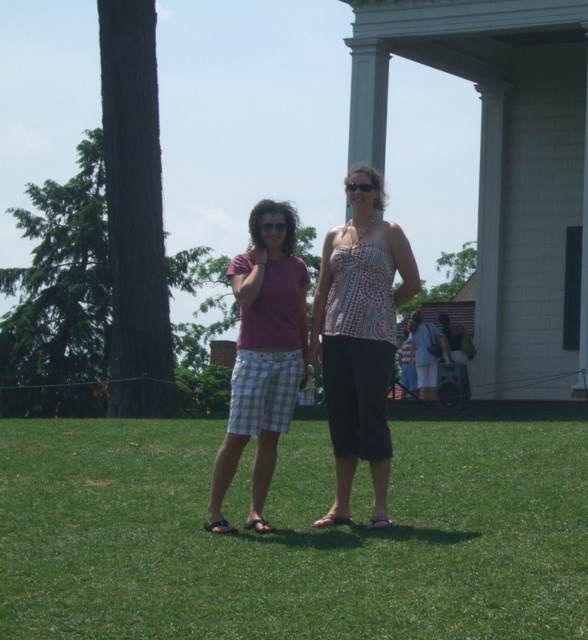
You are planning to set up a picnic blanket in the grassy area. Given that the picnic blanket is the size of the printed fabric top at center, will it fit entirely on the green grass at center?

The green grass at center is bigger than the printed fabric top at center, so the picnic blanket will fit entirely on the green grass at center.

You are planning to lay a picnic blanket on the green grass at center and plaid shorts at center. Which area can accommodate a larger blanket?

The green grass at center has a larger width than the plaid shorts at center, so it can accommodate a larger picnic blanket.

You are planning to place a small garden bench between the green grass at center and the plaid shorts at center. Given that the bench requires 2.5 meters of space, will there be enough room?

The green grass at center is 2.47 meters away from plaid shorts at center. Since the required space is 2.5 meters, there is insufficient space to place the bench between them.